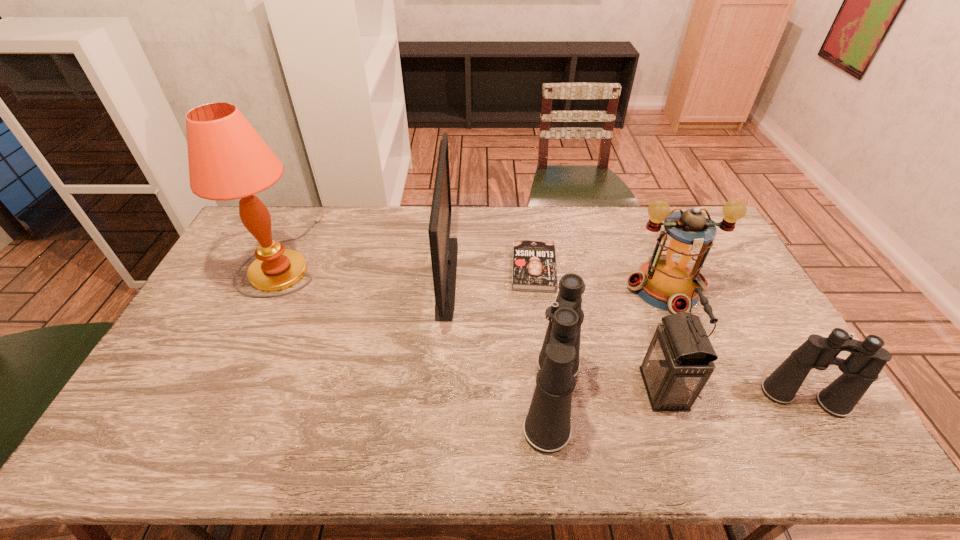
The height and width of the screenshot is (540, 960). In order to click on vacant region that satisfies the following two spatial constraints: 1. on the front side of the leftmost object; 2. on the left side of the shorter binoculars in this screenshot , I will do `click(217, 398)`.

Image resolution: width=960 pixels, height=540 pixels. I want to click on vacant space that satisfies the following two spatial constraints: 1. on the front-facing side of the sixth object from right to left; 2. on the back side of the left binoculars, so click(x=438, y=397).

Image resolution: width=960 pixels, height=540 pixels. In order to click on vacant space that satisfies the following two spatial constraints: 1. on the front-facing side of the rightmost object; 2. on the left side of the nearer lantern in this screenshot , I will do `click(666, 398)`.

Where is `vacant area in the image that satisfies the following two spatial constraints: 1. on the front-facing side of the shorter binoculars; 2. on the left side of the farther lantern`? vacant area in the image that satisfies the following two spatial constraints: 1. on the front-facing side of the shorter binoculars; 2. on the left side of the farther lantern is located at coordinates (712, 398).

At what (x,y) coordinates should I click in order to perform the action: click on vacant space that satisfies the following two spatial constraints: 1. on the front-facing side of the nearer lantern; 2. on the right side of the shorter binoculars. Please return your answer as a coordinate pair (x, y). This screenshot has width=960, height=540. Looking at the image, I should click on (666, 398).